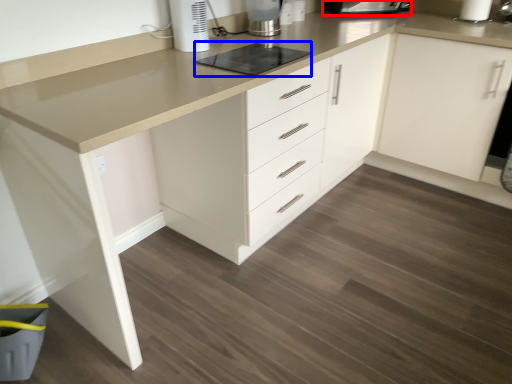
Question: Which object is further to the camera taking this photo, kitchen appliance (highlighted by a red box) or appliance (highlighted by a blue box)?

Choices:
 (A) kitchen appliance
 (B) appliance

Answer: (A)